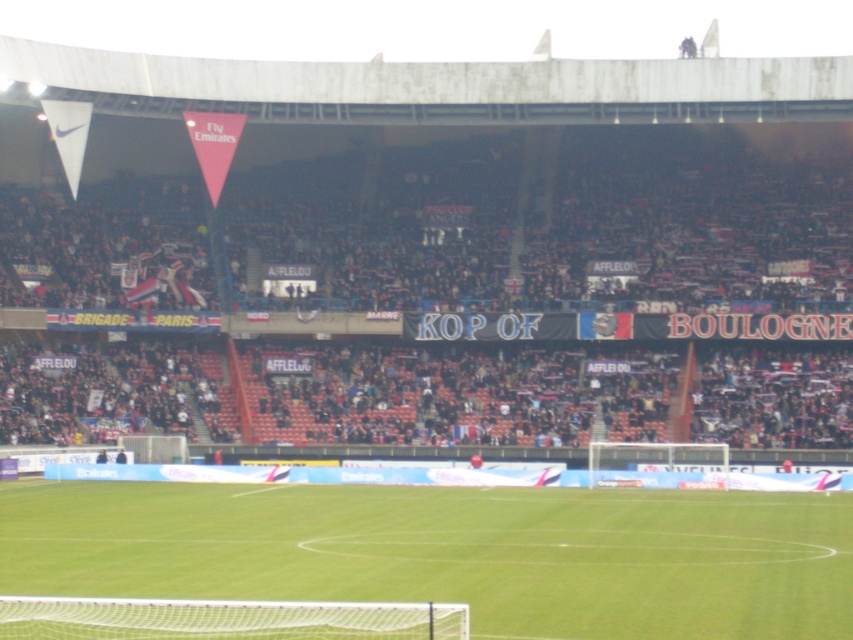
Does dark brown wooden bench at lower center have a greater height compared to green grass football field at center?

Yes, dark brown wooden bench at lower center is taller than green grass football field at center.

Which is more to the left, dark brown wooden bench at lower center or green grass football field at center?

dark brown wooden bench at lower center is more to the left.

The image size is (853, 640). I want to click on dark brown wooden bench at lower center, so click(587, 252).